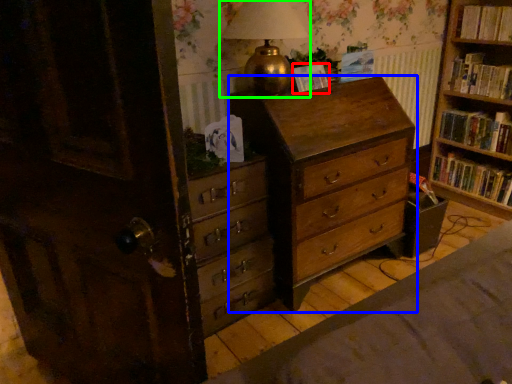
Question: Considering the real-world distances, which object is farthest from paperback book (highlighted by a red box)? chest of drawers (highlighted by a blue box) or table lamp (highlighted by a green box)?

Choices:
 (A) chest of drawers
 (B) table lamp

Answer: (A)